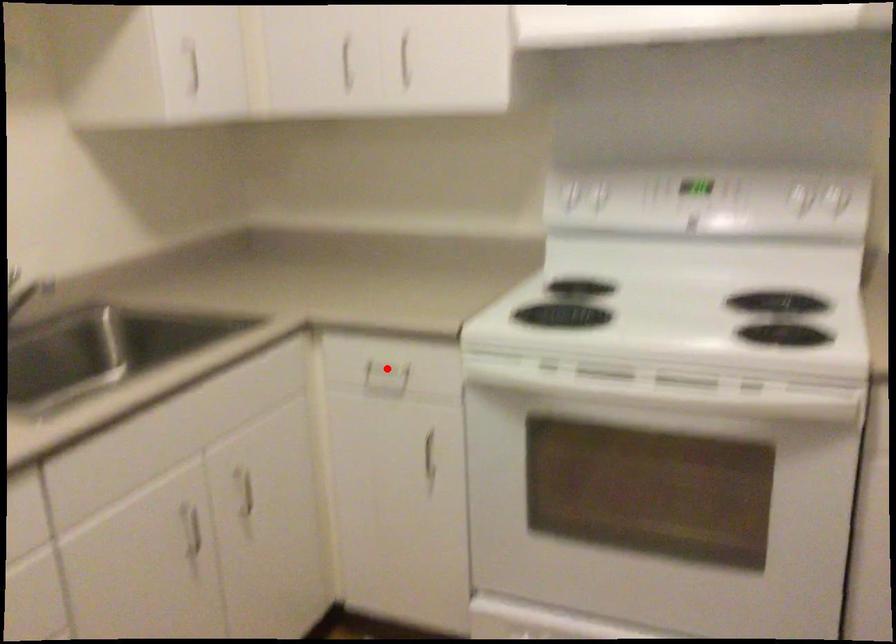
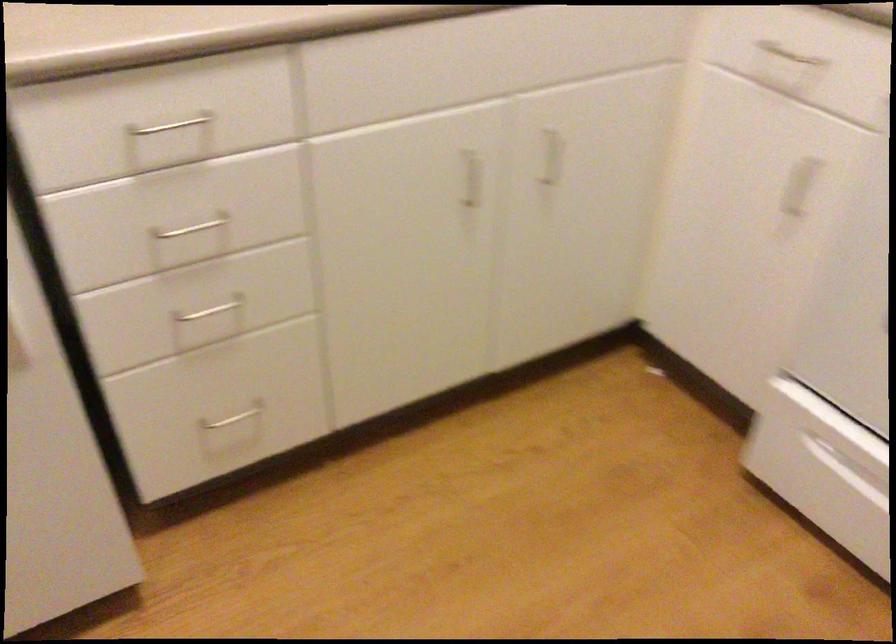
Locate, in the second image, the point that corresponds to the highlighted location in the first image.

(789, 55)